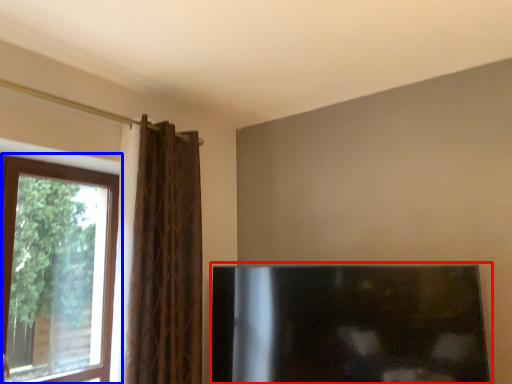
Question: Which object appears farthest to the camera in this image, fireplace (highlighted by a red box) or window (highlighted by a blue box)?

Choices:
 (A) fireplace
 (B) window

Answer: (B)